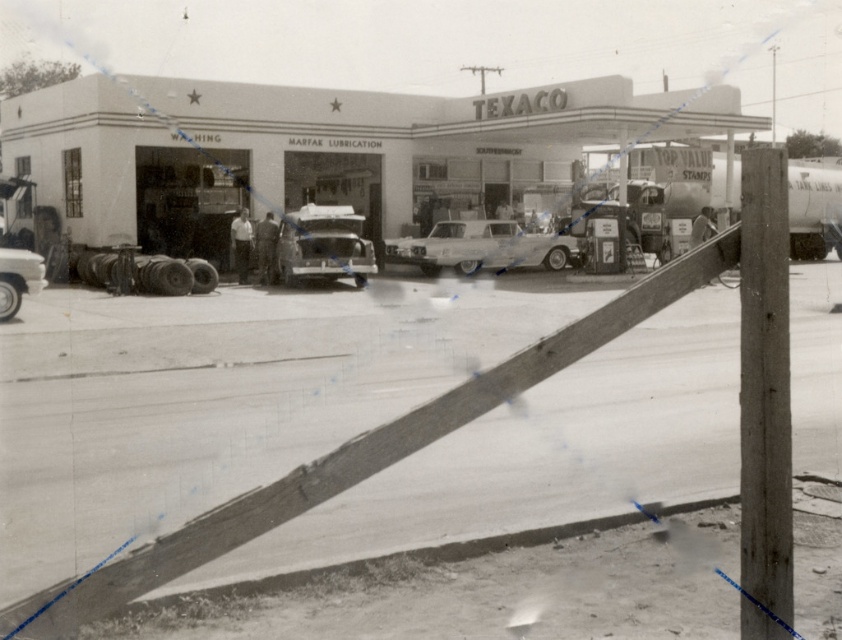
Question: Which point is farther from the camera taking this photo?

Choices:
 (A) (425, 248)
 (B) (35, 260)
 (C) (78, 180)
 (D) (329, 237)

Answer: (A)

Question: Is white concrete building at center above shiny silver car at lower left?

Choices:
 (A) yes
 (B) no

Answer: (A)

Question: Where is shiny chrome car at center located in relation to shiny silver car at lower left in the image?

Choices:
 (A) right
 (B) left

Answer: (A)

Question: Which is nearer to the white concrete building at center?

Choices:
 (A) shiny chrome car at center
 (B) shiny silver car at lower left

Answer: (A)

Question: Which object is farther from the camera taking this photo?

Choices:
 (A) shiny chrome car at center
 (B) shiny silver car at lower left

Answer: (A)

Question: Is the position of shiny silver sedan at center more distant than that of shiny chrome car at center?

Choices:
 (A) no
 (B) yes

Answer: (B)